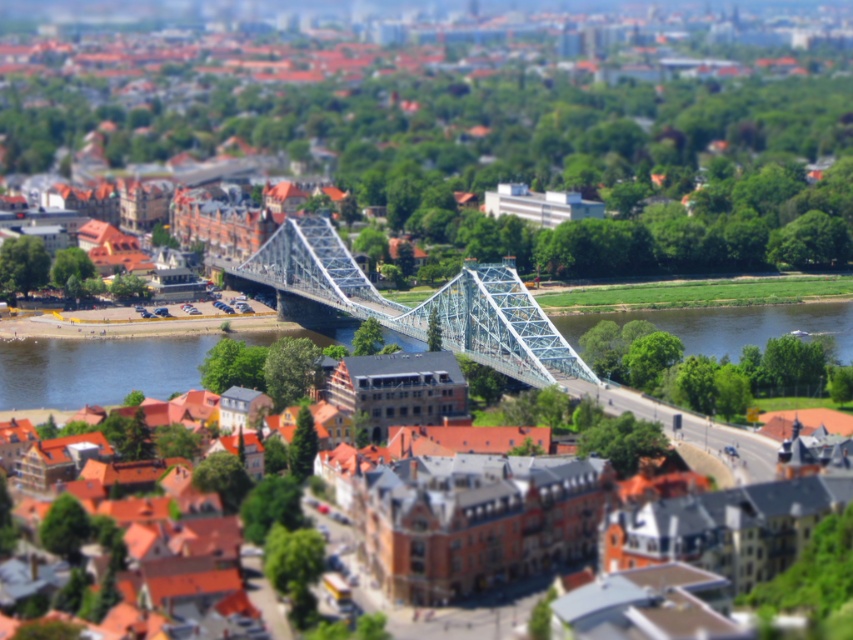
Identify the location of blue metallic river at center. click(96, 369).

How much distance is there between blue metallic river at center and blue metallic bridge at center?

A distance of 116.40 feet exists between blue metallic river at center and blue metallic bridge at center.

In order to click on blue metallic river at center in this screenshot , I will do `click(96, 369)`.